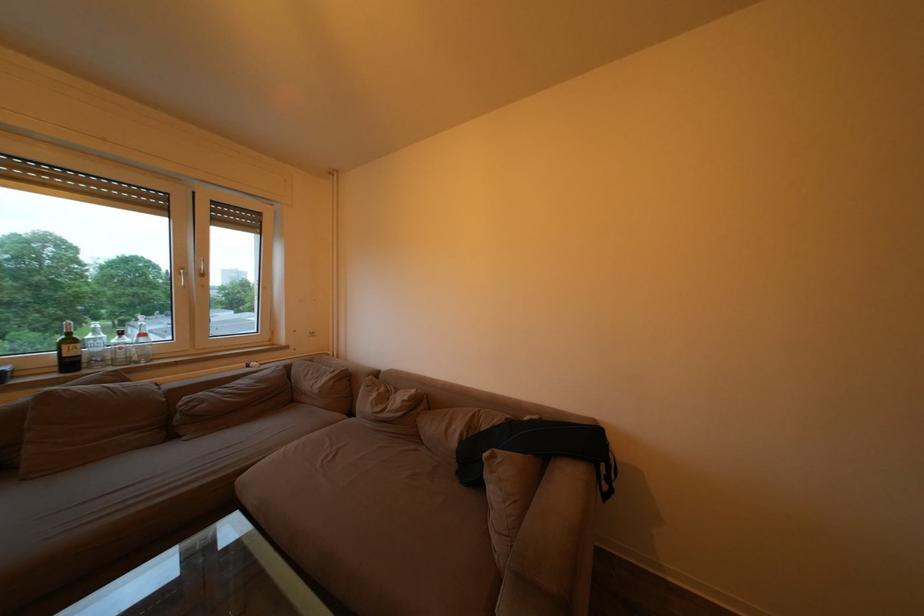
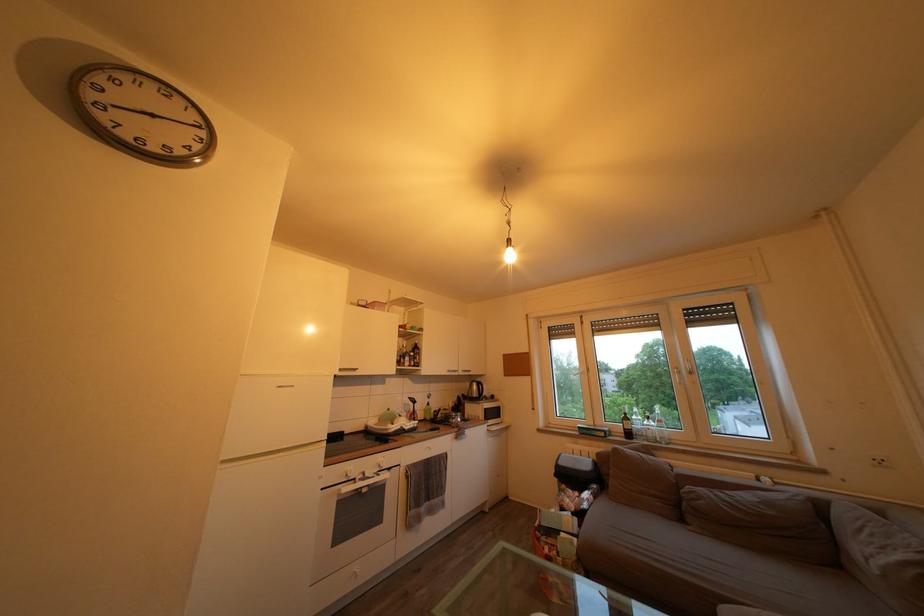
Find the pixel in the second image that matches (x=320, y=339) in the first image.

(889, 468)